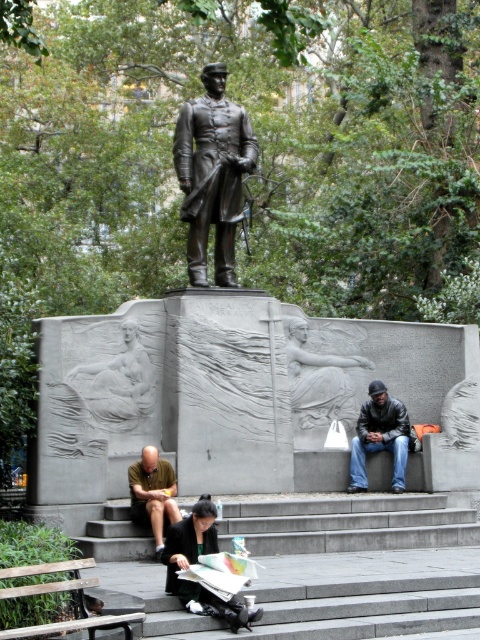
Can you confirm if bronze statue at center is thinner than brown shirt at lower left?

Incorrect, bronze statue at center's width is not less than brown shirt at lower left's.

Who is more forward, (213, 90) or (168, 480)?

Point (168, 480) is in front.

Locate an element on the screen. Image resolution: width=480 pixels, height=640 pixels. bronze statue at center is located at coordinates (213, 173).

Can you confirm if bronze statue at center is smaller than wooden bench at lower left?

Incorrect, bronze statue at center is not smaller in size than wooden bench at lower left.

Can you confirm if bronze statue at center is taller than wooden bench at lower left?

Indeed, bronze statue at center has a greater height compared to wooden bench at lower left.

Which is in front, point (192, 225) or point (39, 573)?

Point (39, 573) is more forward.

At what (x,y) coordinates should I click in order to perform the action: click on bronze statue at center. Please return your answer as a coordinate pair (x, y). Looking at the image, I should click on (213, 173).

How much distance is there between black leather jacket at lower center and wooden bench at lower left?

11.66 feet

Between black leather jacket at lower center and wooden bench at lower left, which one is positioned higher?

wooden bench at lower left is higher up.

Between point (169, 525) and point (62, 621), which one is positioned in front?

Positioned in front is point (62, 621).

Where is `black leather jacket at lower center`? black leather jacket at lower center is located at coordinates (195, 563).